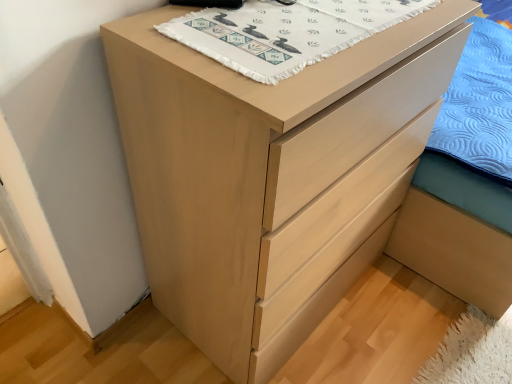
Question: Considering the positions of point (243, 41) and point (440, 253), is point (243, 41) closer or farther from the camera than point (440, 253)?

Choices:
 (A) farther
 (B) closer

Answer: (B)

Question: In terms of width, does white woven cloth at upper center look wider or thinner when compared to light brown wood bed frame at lower right?

Choices:
 (A) thin
 (B) wide

Answer: (A)

Question: In terms of size, does white woven cloth at upper center appear bigger or smaller than light brown wood bed frame at lower right?

Choices:
 (A) small
 (B) big

Answer: (A)

Question: In the image, is light brown wood bed frame at lower right on the left side or the right side of white woven cloth at upper center?

Choices:
 (A) left
 (B) right

Answer: (B)

Question: Is point (508, 294) closer or farther from the camera than point (309, 46)?

Choices:
 (A) farther
 (B) closer

Answer: (A)

Question: Is light brown wood bed frame at lower right in front of or behind white woven cloth at upper center in the image?

Choices:
 (A) front
 (B) behind

Answer: (B)

Question: Is light brown wood bed frame at lower right spatially inside white woven cloth at upper center, or outside of it?

Choices:
 (A) inside
 (B) outside

Answer: (B)